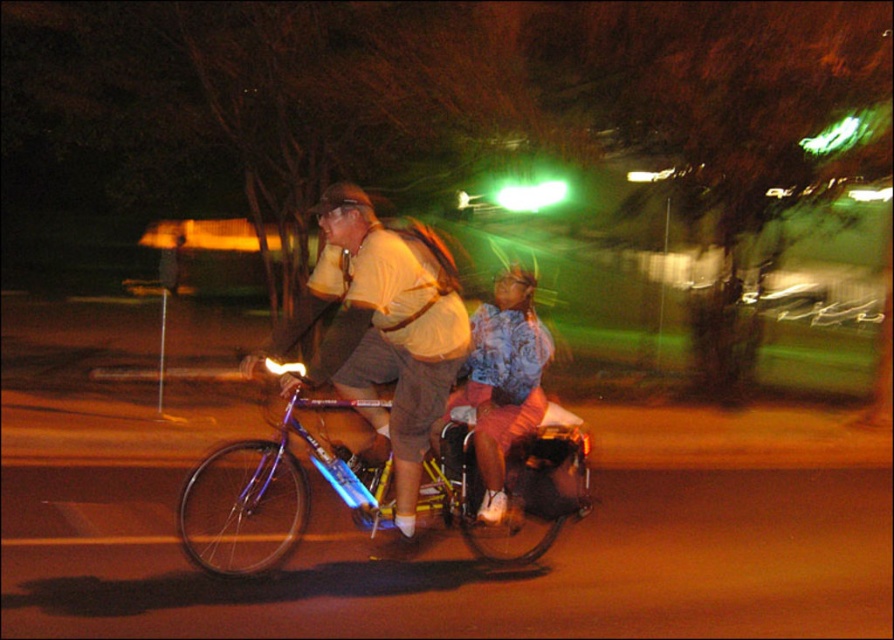
Can you confirm if matte yellow shirt at center is shorter than blue floral shirt at center?

In fact, matte yellow shirt at center may be taller than blue floral shirt at center.

Is matte yellow shirt at center positioned before blue floral shirt at center?

That is True.

Locate an element on the screen. This screenshot has width=894, height=640. matte yellow shirt at center is located at coordinates (384, 326).

Measure the distance from shiny metallic bicycle at center to blue floral shirt at center.

The distance of shiny metallic bicycle at center from blue floral shirt at center is 3.92 feet.

From the picture: Between shiny metallic bicycle at center and blue floral shirt at center, which one has less height?

Standing shorter between the two is shiny metallic bicycle at center.

You are a GUI agent. You are given a task and a screenshot of the screen. Output one action in this format:
    pyautogui.click(x=<x>, y=<y>)
    Task: Click on the shiny metallic bicycle at center
    Image resolution: width=894 pixels, height=640 pixels.
    Given the screenshot: What is the action you would take?
    pyautogui.click(x=274, y=492)

The image size is (894, 640). Describe the element at coordinates (274, 492) in the screenshot. I see `shiny metallic bicycle at center` at that location.

At what (x,y) coordinates should I click in order to perform the action: click on shiny metallic bicycle at center. Please return your answer as a coordinate pair (x, y). This screenshot has height=640, width=894. Looking at the image, I should click on (274, 492).